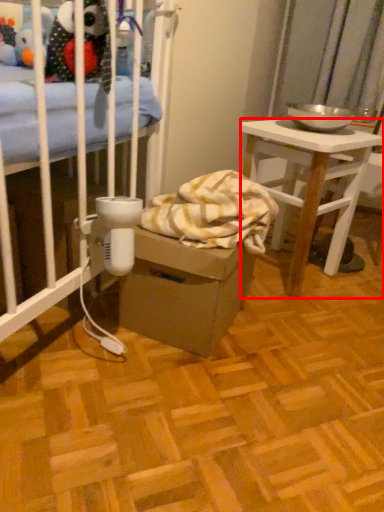
Question: From the image, what is the correct spatial relationship of desk (annotated by the red box) in relation to cardboard box?

Choices:
 (A) right
 (B) left

Answer: (A)